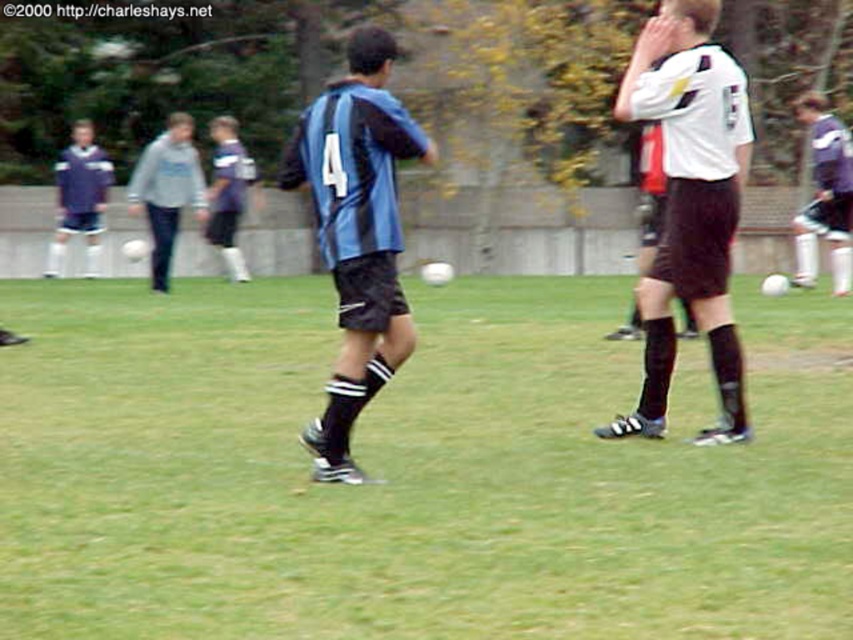
Which is behind, point (840, 276) or point (61, 264)?

Point (61, 264)

Does purple jersey at right appear over matte blue jersey at left?

Incorrect, purple jersey at right is not positioned above matte blue jersey at left.

Is point (848, 246) positioned behind point (96, 176)?

That is False.

Where is `purple jersey at right`? Image resolution: width=853 pixels, height=640 pixels. purple jersey at right is located at coordinates (825, 195).

Consider the image. Which is more to the left, white matte jersey at center or purple jersey at right?

white matte jersey at center

Is point (720, 420) closer to camera compared to point (798, 243)?

Yes.

Locate an element on the screen. This screenshot has width=853, height=640. white matte jersey at center is located at coordinates pos(689,205).

Identify the location of white matte jersey at center. (689, 205).

At what (x,y) coordinates should I click in order to perform the action: click on purple jersey at right. Please return your answer as a coordinate pair (x, y). This screenshot has height=640, width=853. Looking at the image, I should click on (825, 195).

Can you confirm if purple jersey at right is positioned to the right of gray fleece jacket at center?

Yes, purple jersey at right is to the right of gray fleece jacket at center.

Is point (816, 163) closer to viewer compared to point (138, 157)?

Yes, point (816, 163) is closer to viewer.

Locate an element on the screen. This screenshot has width=853, height=640. purple jersey at right is located at coordinates (825, 195).